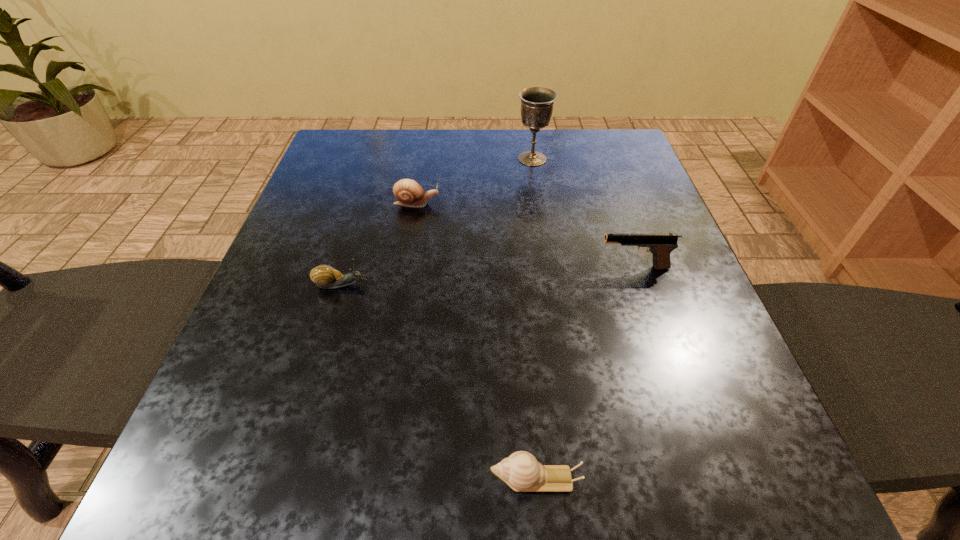
What are the coordinates of `the tallest object` in the screenshot? It's located at [x=537, y=103].

I want to click on chalice, so click(537, 103).

The image size is (960, 540). What are the coordinates of `the fourth shortest object` in the screenshot? It's located at (660, 245).

Identify the location of pistol. This screenshot has width=960, height=540. (660, 245).

In order to click on the second escargot from left to right in this screenshot , I will do `click(408, 192)`.

The image size is (960, 540). In order to click on the second object from left to right in this screenshot , I will do tap(408, 192).

Identify the location of the second nearest object. (325, 276).

You are a GUI agent. You are given a task and a screenshot of the screen. Output one action in this format:
    pyautogui.click(x=<x>, y=<y>)
    Task: Click on the leftmost escargot
    This screenshot has height=540, width=960.
    Given the screenshot: What is the action you would take?
    pyautogui.click(x=325, y=276)

Where is `the nearest object`? The width and height of the screenshot is (960, 540). the nearest object is located at coordinates (x=521, y=471).

This screenshot has height=540, width=960. Identify the location of the rightmost escargot. (521, 471).